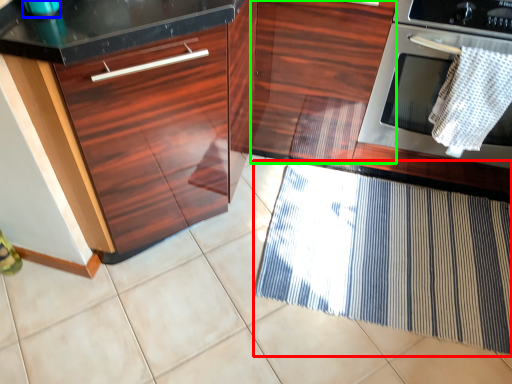
Question: Which object is the farthest from doormat (highlighted by a red box)? Choose among these: appliance (highlighted by a blue box) or cabinetry (highlighted by a green box).

Choices:
 (A) appliance
 (B) cabinetry

Answer: (A)